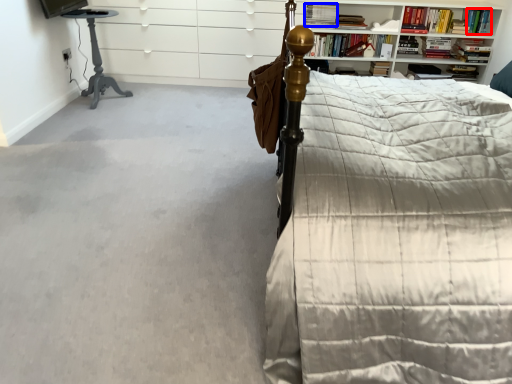
Question: Which point is further to the camera, book (highlighted by a red box) or book (highlighted by a blue box)?

Choices:
 (A) book
 (B) book

Answer: (A)